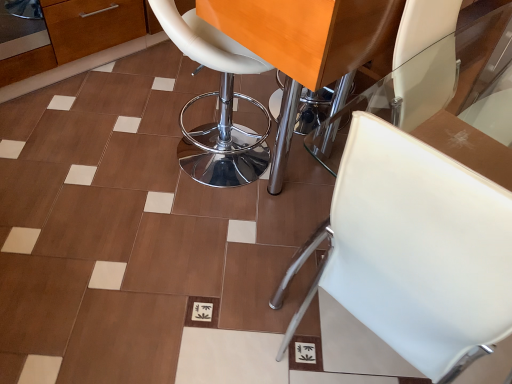
At what (x,y) coordinates should I click in order to perform the action: click on blank area to the left of white leather chair at center, positioned as the 2th chair in left-to-right order. Please return your answer as a coordinate pair (x, y). The height and width of the screenshot is (384, 512). Looking at the image, I should click on (172, 259).